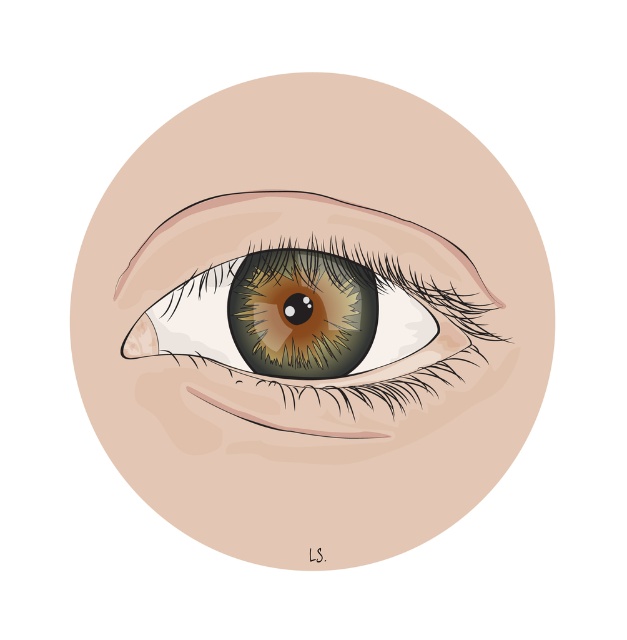
Question: Among these objects, which one is nearest to the camera?

Choices:
 (A) brown matte eye at center
 (B) brown glossy eye at center

Answer: (B)

Question: Which point is farther to the camera?

Choices:
 (A) (283, 243)
 (B) (282, 221)

Answer: (B)

Question: Is brown glossy eye at center thinner than brown matte eye at center?

Choices:
 (A) no
 (B) yes

Answer: (A)

Question: Is brown glossy eye at center positioned at the back of brown matte eye at center?

Choices:
 (A) yes
 (B) no

Answer: (B)

Question: Can you confirm if brown glossy eye at center is positioned above brown matte eye at center?

Choices:
 (A) yes
 (B) no

Answer: (B)